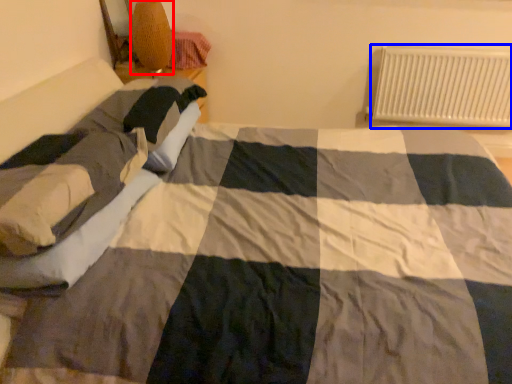
Question: Which point is further to the camera, lamp (highlighted by a red box) or radiator (highlighted by a blue box)?

Choices:
 (A) lamp
 (B) radiator

Answer: (B)